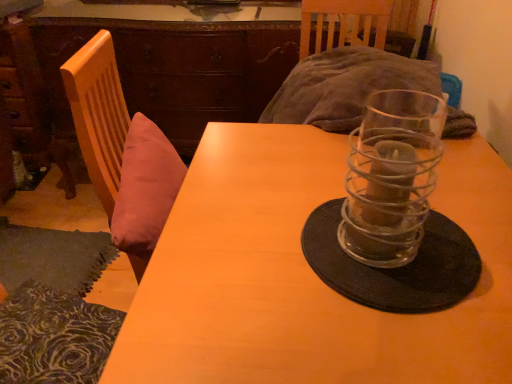
The width and height of the screenshot is (512, 384). What do you see at coordinates (306, 275) in the screenshot?
I see `wooden table at center` at bounding box center [306, 275].

Measure the distance between point (x=405, y=155) and camera.

Point (x=405, y=155) is 26.93 inches away from camera.

What is the approximate width of clear glass candle holder at center?

The width of clear glass candle holder at center is 6.83 inches.

Locate an element on the screen. This screenshot has height=384, width=512. black matte glass plate at center is located at coordinates (395, 268).

What are the coordinates of `brown wood dresser at upper left` in the screenshot? It's located at (146, 73).

At what (x,y) coordinates should I click in order to perform the action: click on wooden table at center. Please return your answer as a coordinate pair (x, y). The width and height of the screenshot is (512, 384). Looking at the image, I should click on (306, 275).

Considering the relative sizes of clear glass candle holder at center and brown wood dresser at upper left in the image provided, is clear glass candle holder at center smaller than brown wood dresser at upper left?

Correct, clear glass candle holder at center occupies less space than brown wood dresser at upper left.

Relative to brown wood dresser at upper left, is clear glass candle holder at center in front or behind?

clear glass candle holder at center is positioned closer to the viewer than brown wood dresser at upper left.

Is clear glass candle holder at center taller than brown wood dresser at upper left?

Incorrect, the height of clear glass candle holder at center is not larger of that of brown wood dresser at upper left.

Consider the image. Is clear glass candle holder at center not close to black matte glass plate at center?

→ No, clear glass candle holder at center is not far from black matte glass plate at center.

Considering the points (364, 177) and (327, 209), which point is in front, point (364, 177) or point (327, 209)?

The point (364, 177) is closer.

Considering the positions of objects clear glass candle holder at center and black matte glass plate at center in the image provided, who is in front, clear glass candle holder at center or black matte glass plate at center?

clear glass candle holder at center is closer to the camera.

From the image's perspective, which one is positioned higher, clear glass candle holder at center or wooden table at center?

clear glass candle holder at center, from the image's perspective.

Based on the photo, between clear glass candle holder at center and wooden table at center, which one appears on the right side from the viewer's perspective?

clear glass candle holder at center is more to the right.

From a real-world perspective, is clear glass candle holder at center above or below wooden table at center?

Clearly, from a real-world perspective, clear glass candle holder at center is above wooden table at center.

Is wooden table at center beside black matte glass plate at center?

No, wooden table at center is not making contact with black matte glass plate at center.

From the image's perspective, does wooden table at center appear higher than black matte glass plate at center?

No.

This screenshot has width=512, height=384. I want to click on table below the black matte glass plate at center (from a real-world perspective), so click(x=306, y=275).

Considering the relative sizes of wooden table at center and black matte glass plate at center in the image provided, is wooden table at center taller than black matte glass plate at center?

Correct, wooden table at center is much taller as black matte glass plate at center.

How many degrees apart are the facing directions of black matte glass plate at center and brown wood dresser at upper left?

84.2 degrees separate the facing orientations of black matte glass plate at center and brown wood dresser at upper left.

Is black matte glass plate at center closer to the viewer compared to brown wood dresser at upper left?

Yes, black matte glass plate at center is closer to the camera.

This screenshot has width=512, height=384. Identify the location of glass plate on the right of brown wood dresser at upper left. (395, 268).

From a real-world perspective, which is physically above, brown wood dresser at upper left or wooden table at center?

brown wood dresser at upper left, from a real-world perspective.

What's the angular difference between brown wood dresser at upper left and wooden table at center's facing directions?

The facing directions of brown wood dresser at upper left and wooden table at center are 87.4 degrees apart.

Between brown wood dresser at upper left and wooden table at center, which one is positioned behind?

brown wood dresser at upper left.

Would you say brown wood dresser at upper left is a long distance from wooden table at center?

Absolutely, brown wood dresser at upper left is distant from wooden table at center.

How many degrees apart are the facing directions of wooden table at center and brown wood dresser at upper left?

87.4 degrees separate the facing orientations of wooden table at center and brown wood dresser at upper left.

Does point (290, 323) appear closer or farther from the camera than point (14, 27)?

Point (290, 323) is closer to the camera than point (14, 27).

Is wooden table at center facing away from brown wood dresser at upper left?

That's not correct — wooden table at center is not looking away from brown wood dresser at upper left.

From the image's perspective, does wooden table at center appear lower than brown wood dresser at upper left?

Correct, wooden table at center appears lower than brown wood dresser at upper left in the image.

This screenshot has width=512, height=384. In order to click on dresser above the clear glass candle holder at center (from the image's perspective) in this screenshot , I will do tap(146, 73).

This screenshot has width=512, height=384. Find the location of `glass plate below the clear glass candle holder at center (from a real-world perspective)`. glass plate below the clear glass candle holder at center (from a real-world perspective) is located at coordinates click(395, 268).

Considering their positions, is clear glass candle holder at center positioned further to wooden table at center than brown wood dresser at upper left?

The object further to wooden table at center is brown wood dresser at upper left.

Which object lies further to the anchor point brown wood dresser at upper left, wooden table at center or clear glass candle holder at center?

clear glass candle holder at center is positioned further to the anchor brown wood dresser at upper left.

Which object lies nearer to the anchor point black matte glass plate at center, brown wood dresser at upper left or wooden table at center?

The object closer to black matte glass plate at center is wooden table at center.

Considering their positions, is wooden table at center positioned further to brown wood dresser at upper left than black matte glass plate at center?

black matte glass plate at center is further to brown wood dresser at upper left.

Which object lies further to the anchor point brown wood dresser at upper left, clear glass candle holder at center or black matte glass plate at center?

black matte glass plate at center lies further to brown wood dresser at upper left than the other object.

Based on their spatial positions, is brown wood dresser at upper left or clear glass candle holder at center further from wooden table at center?

brown wood dresser at upper left lies further to wooden table at center than the other object.

Based on their spatial positions, is wooden table at center or brown wood dresser at upper left closer to clear glass candle holder at center?

Based on the image, wooden table at center appears to be nearer to clear glass candle holder at center.

Looking at the image, which one is located closer to black matte glass plate at center, wooden table at center or clear glass candle holder at center?

Based on the image, clear glass candle holder at center appears to be nearer to black matte glass plate at center.

I want to click on glass plate between wooden table at center and brown wood dresser at upper left from front to back, so click(x=395, y=268).

Where is `tableware between wooden table at center and brown wood dresser at upper left in the front-back direction`? Image resolution: width=512 pixels, height=384 pixels. tableware between wooden table at center and brown wood dresser at upper left in the front-back direction is located at coordinates (392, 177).

Find the location of a particular element. The image size is (512, 384). glass plate between clear glass candle holder at center and brown wood dresser at upper left in the front-back direction is located at coordinates (395, 268).

Where is `glass plate between clear glass candle holder at center and wooden table at center in the up-down direction`? This screenshot has height=384, width=512. glass plate between clear glass candle holder at center and wooden table at center in the up-down direction is located at coordinates [x=395, y=268].